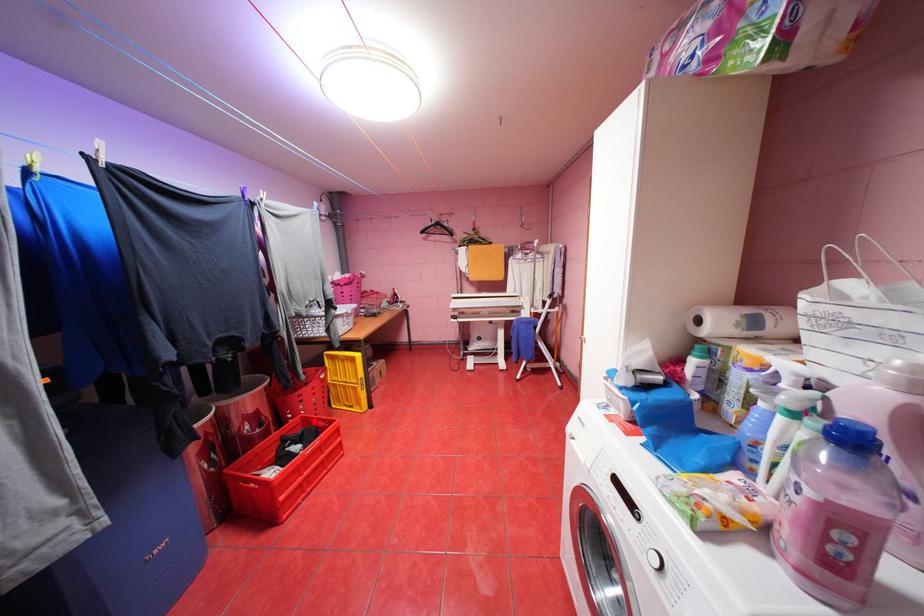
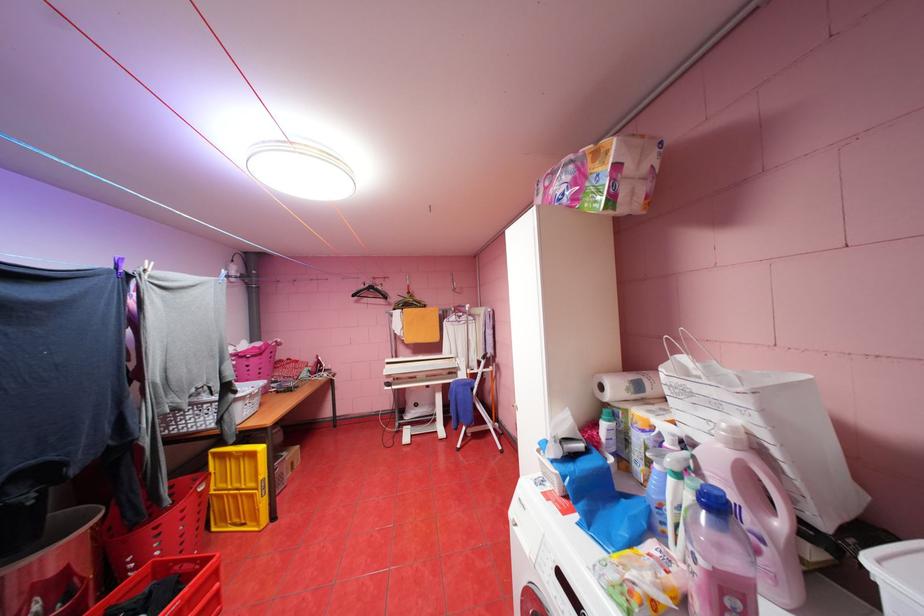
The point at the highlighted location is marked in the first image. Where is the corresponding point in the second image?

(169, 569)